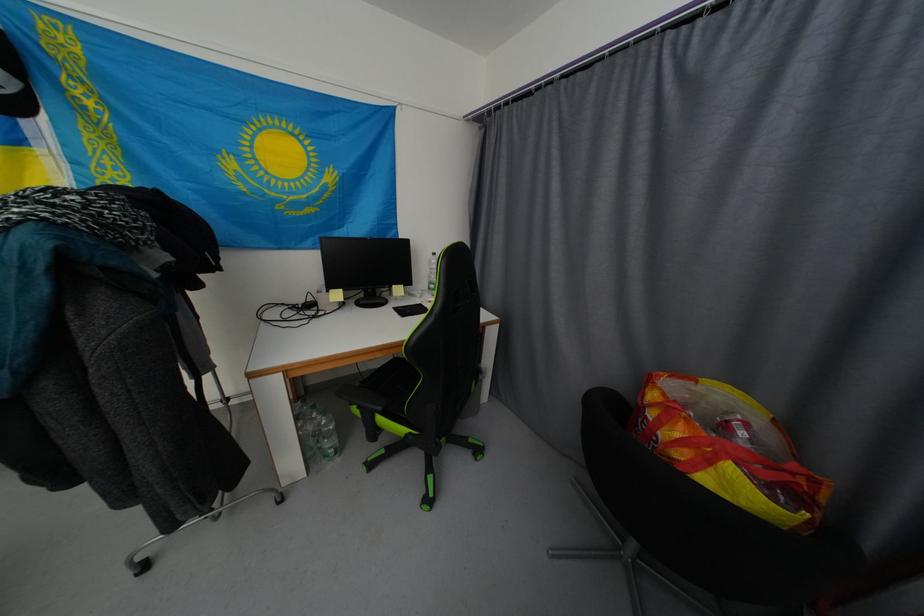
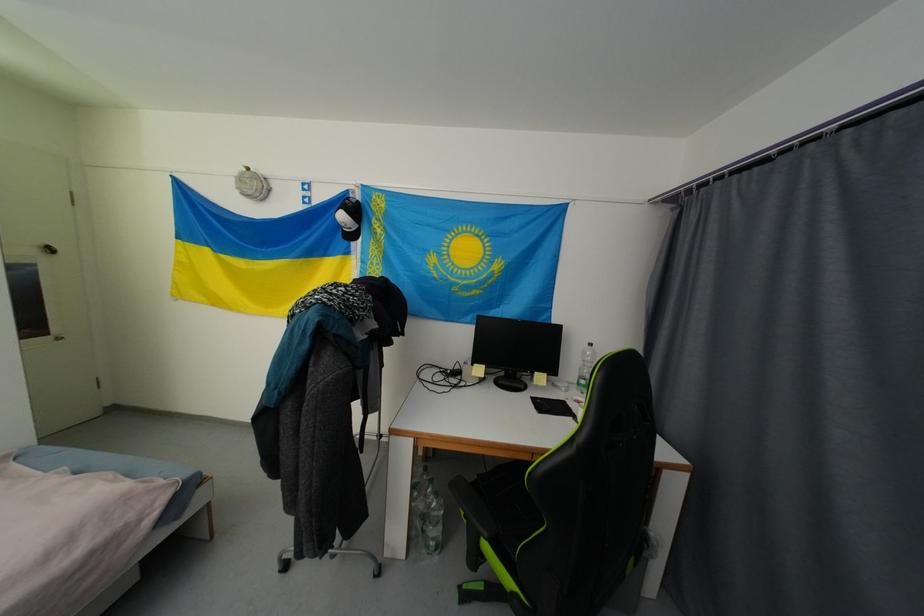
Where in the second image is the point corresponding to point (404, 292) from the first image?

(545, 379)